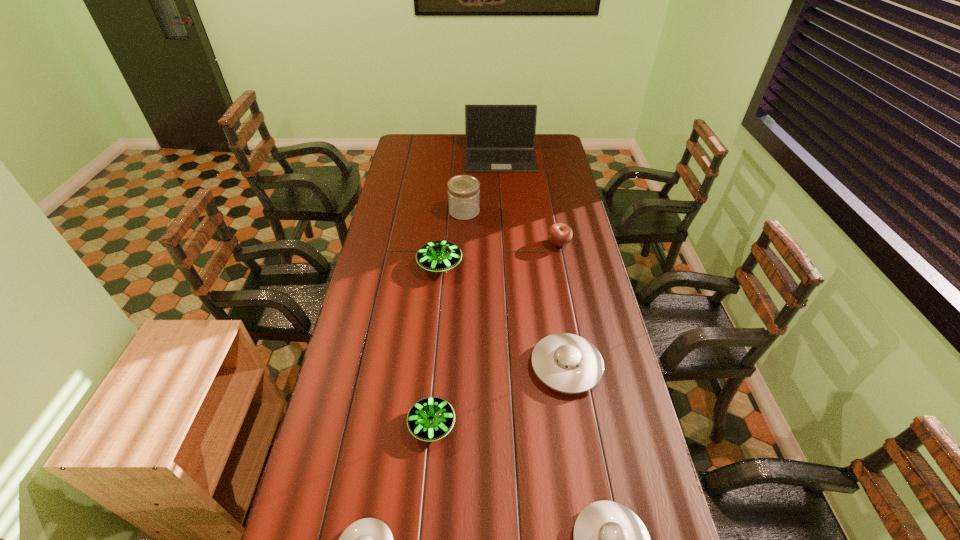
Find the location of `laptop that is at the right edge`. laptop that is at the right edge is located at coordinates (499, 138).

Find the location of a particular element. Image resolution: width=960 pixels, height=540 pixels. apple at the right edge is located at coordinates (560, 234).

Locate an element on the screen. saucer located in the right edge section of the desktop is located at coordinates (567, 363).

I want to click on object that is at the far right corner, so click(x=499, y=138).

Locate an element on the screen. vacant space at the left edge of the desktop is located at coordinates (318, 447).

Identify the location of free space at the right edge. This screenshot has width=960, height=540. (603, 434).

I want to click on vacant region at the far right corner of the desktop, so [538, 140].

In order to click on vacant space that is in between the farthest object and the apple in this screenshot , I will do `click(530, 200)`.

Locate an element on the screen. Image resolution: width=960 pixels, height=540 pixels. free space between the farthest object and the nearer green saucer is located at coordinates (467, 291).

The height and width of the screenshot is (540, 960). Find the location of `empty space between the fifth farthest object and the apple`. empty space between the fifth farthest object and the apple is located at coordinates (563, 305).